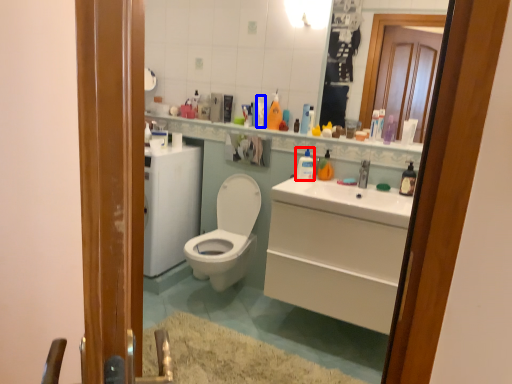
Question: Which object appears closest to the camera in this image, cleaning product (highlighted by a red box) or toiletry (highlighted by a blue box)?

Choices:
 (A) cleaning product
 (B) toiletry

Answer: (A)